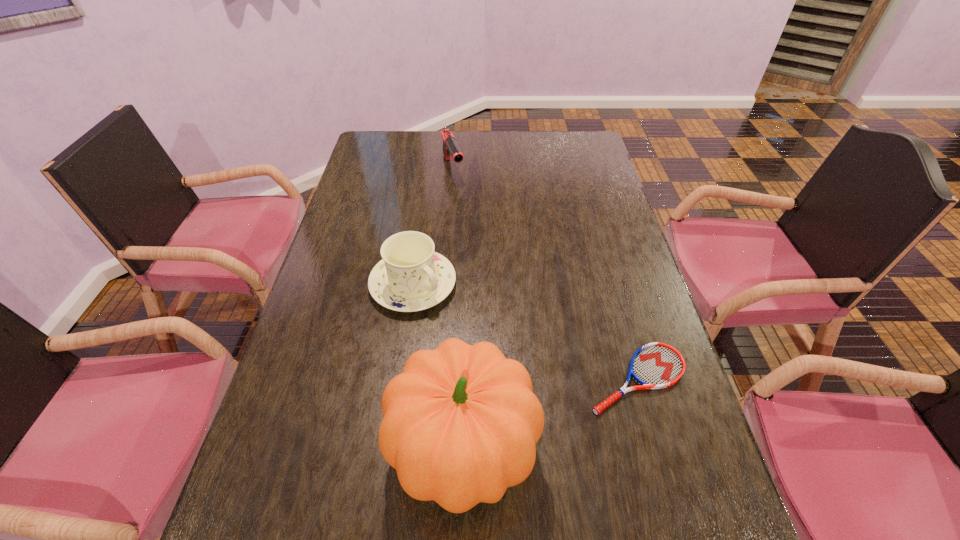
Where is `pumpkin`? The height and width of the screenshot is (540, 960). pumpkin is located at coordinates click(x=460, y=425).

I want to click on the shortest object, so click(x=656, y=365).

Where is `tennis racket`? This screenshot has width=960, height=540. tennis racket is located at coordinates (656, 365).

The image size is (960, 540). Find the location of `the farthest object`. the farthest object is located at coordinates (450, 147).

Find the location of a particular element. This screenshot has height=540, width=960. chinaware is located at coordinates (411, 277).

This screenshot has height=540, width=960. I want to click on vacant space located 0.140m on the left of the pumpkin, so tap(322, 450).

At what (x,y) coordinates should I click in order to perform the action: click on free region located on the left of the tennis racket. Please return your answer as a coordinate pair (x, y). Image resolution: width=960 pixels, height=540 pixels. Looking at the image, I should click on (432, 379).

Find the location of a particular element. The image size is (960, 540). free space located 0.350m at the aiming end of the gun is located at coordinates (486, 249).

Image resolution: width=960 pixels, height=540 pixels. I want to click on free spot located at the aiming end of the gun, so click(x=490, y=258).

This screenshot has height=540, width=960. I want to click on vacant space situated 0.120m at the aiming end of the gun, so click(465, 205).